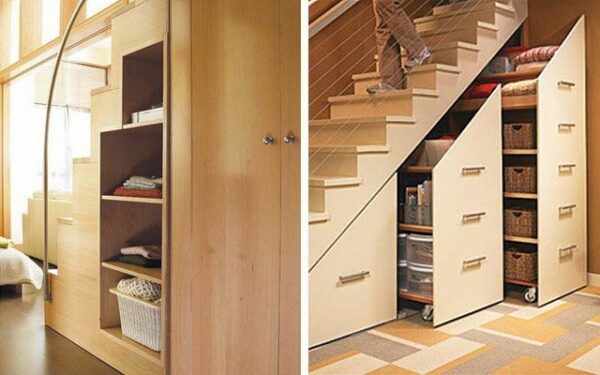
Where is `staircase`? Image resolution: width=600 pixels, height=375 pixels. staircase is located at coordinates (423, 107).